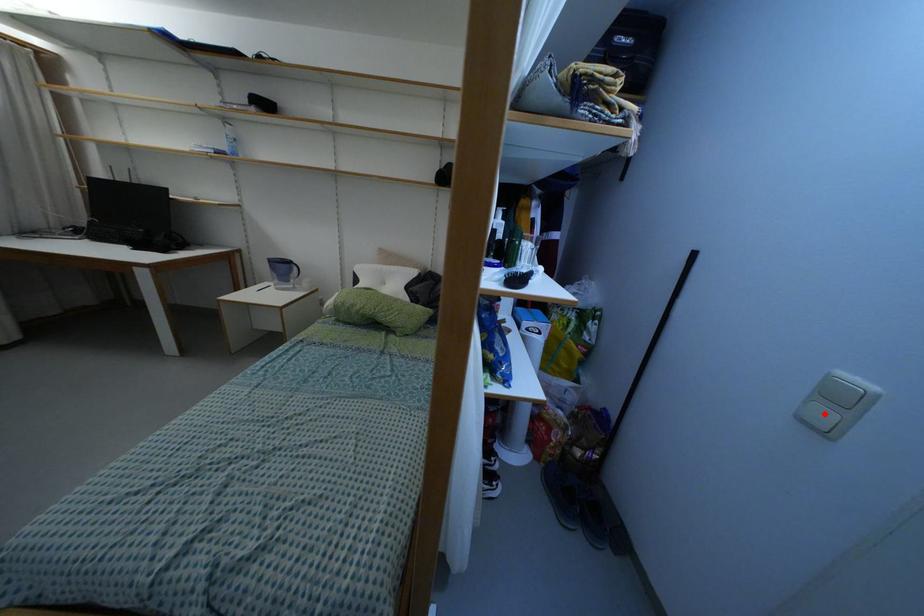
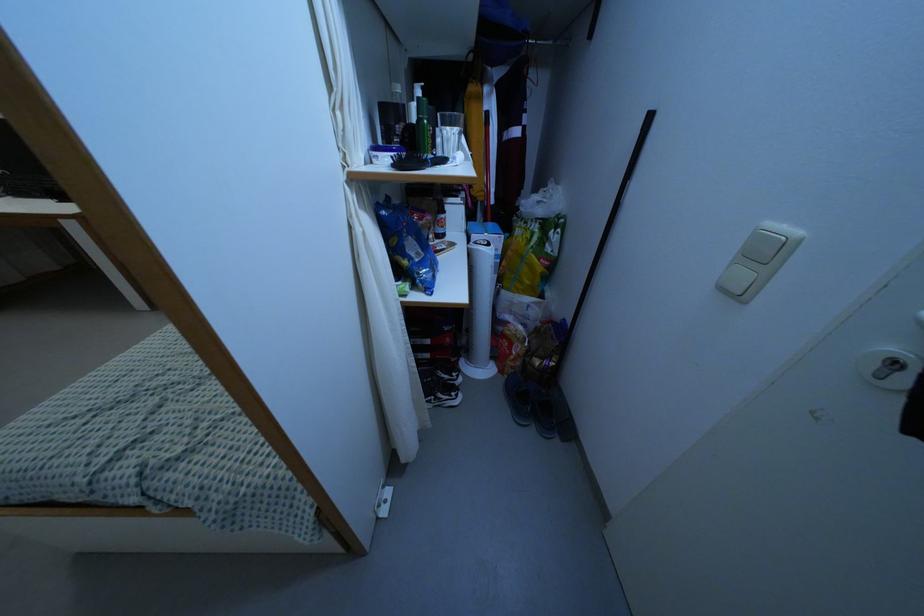
The point at the highlighted location is marked in the first image. Where is the corresponding point in the second image?

(743, 276)